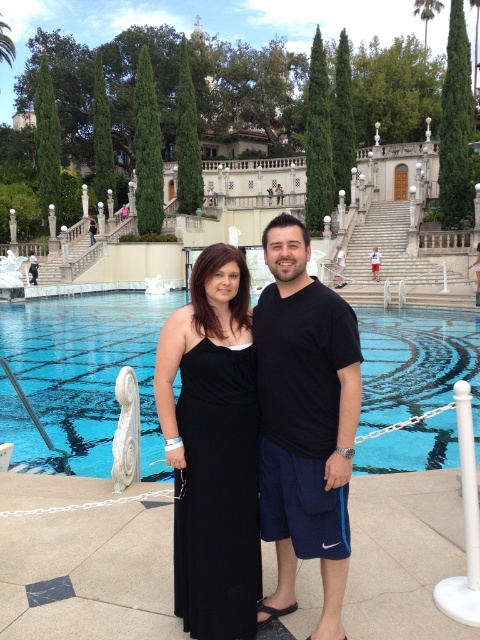
Is black cotton t-shirt at center to the right of black satin dress at center from the viewer's perspective?

Yes, black cotton t-shirt at center is to the right of black satin dress at center.

Is point (356, 408) positioned after point (203, 506)?

That is False.

Is point (291, 557) positioned in front of point (192, 540)?

No, (291, 557) is further to viewer.

The height and width of the screenshot is (640, 480). In order to click on black cotton t-shirt at center in this screenshot , I will do click(304, 420).

Is blue glass swimming pool at center below black cotton t-shirt at center?

Incorrect, blue glass swimming pool at center is not positioned below black cotton t-shirt at center.

Who is higher up, blue glass swimming pool at center or black cotton t-shirt at center?

blue glass swimming pool at center is higher up.

Is point (108, 433) positioned in front of point (272, 465)?

No, (108, 433) is further to viewer.

Find the location of a particular element. blue glass swimming pool at center is located at coordinates (81, 378).

Is blue glass swimming pool at center to the left of black satin dress at center from the viewer's perspective?

Yes, blue glass swimming pool at center is to the left of black satin dress at center.

Which is in front, point (36, 317) or point (189, 392)?

Point (189, 392)

Between point (69, 472) and point (182, 433), which one is positioned behind?

The point (69, 472) is behind.

This screenshot has width=480, height=640. In order to click on blue glass swimming pool at center in this screenshot , I will do `click(81, 378)`.